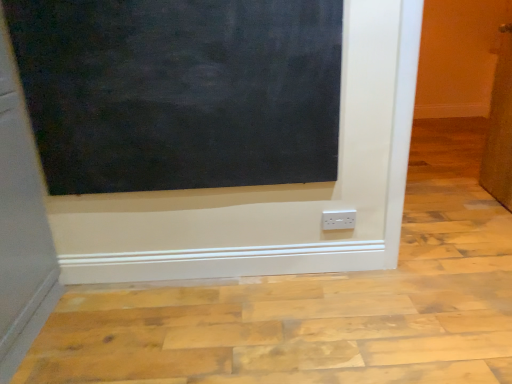
Question: Are white plastic power plugs and sockets at lower center and black matte board at upper left far apart?

Choices:
 (A) no
 (B) yes

Answer: (A)

Question: Is white plastic power plugs and sockets at lower center facing towards black matte board at upper left?

Choices:
 (A) no
 (B) yes

Answer: (A)

Question: Considering the relative sizes of white plastic power plugs and sockets at lower center and black matte board at upper left in the image provided, is white plastic power plugs and sockets at lower center wider than black matte board at upper left?

Choices:
 (A) yes
 (B) no

Answer: (B)

Question: Can you confirm if white plastic power plugs and sockets at lower center is taller than black matte board at upper left?

Choices:
 (A) no
 (B) yes

Answer: (A)

Question: Is white plastic power plugs and sockets at lower center behind black matte board at upper left?

Choices:
 (A) no
 (B) yes

Answer: (B)

Question: Would you say brown textured door at right is to the left or to the right of black matte board at upper left in the picture?

Choices:
 (A) right
 (B) left

Answer: (A)

Question: Is brown textured door at right situated inside black matte board at upper left or outside?

Choices:
 (A) inside
 (B) outside

Answer: (B)

Question: From a real-world perspective, is brown textured door at right positioned above or below black matte board at upper left?

Choices:
 (A) below
 (B) above

Answer: (A)

Question: Is point (487, 147) closer or farther from the camera than point (278, 152)?

Choices:
 (A) farther
 (B) closer

Answer: (A)

Question: From the image's perspective, relative to black matte board at upper left, is white plastic power plugs and sockets at lower center above or below?

Choices:
 (A) below
 (B) above

Answer: (A)

Question: Do you think white plastic power plugs and sockets at lower center is within black matte board at upper left, or outside of it?

Choices:
 (A) inside
 (B) outside

Answer: (B)

Question: Based on their sizes in the image, would you say white plastic power plugs and sockets at lower center is bigger or smaller than black matte board at upper left?

Choices:
 (A) big
 (B) small

Answer: (B)

Question: Is point (323, 226) positioned closer to the camera than point (31, 120)?

Choices:
 (A) farther
 (B) closer

Answer: (A)

Question: From a real-world perspective, relative to brown textured door at right, is white plastic power plugs and sockets at lower center vertically above or below?

Choices:
 (A) below
 (B) above

Answer: (A)

Question: Is point (345, 226) positioned closer to the camera than point (505, 124)?

Choices:
 (A) closer
 (B) farther

Answer: (A)